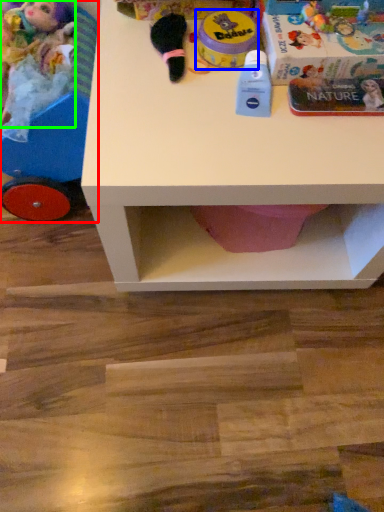
Question: Which object is the farthest from toy (highlighted by a red box)? Choose among these: toy (highlighted by a blue box) or toy (highlighted by a green box).

Choices:
 (A) toy
 (B) toy

Answer: (A)